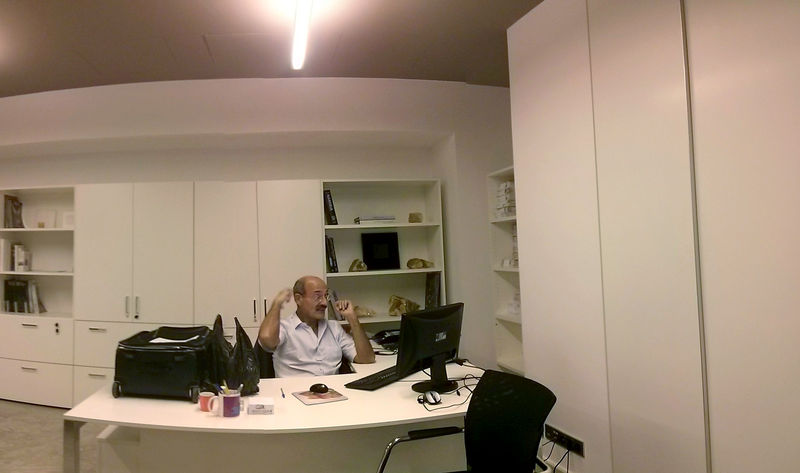
Where is `monitor`? monitor is located at coordinates (438, 341).